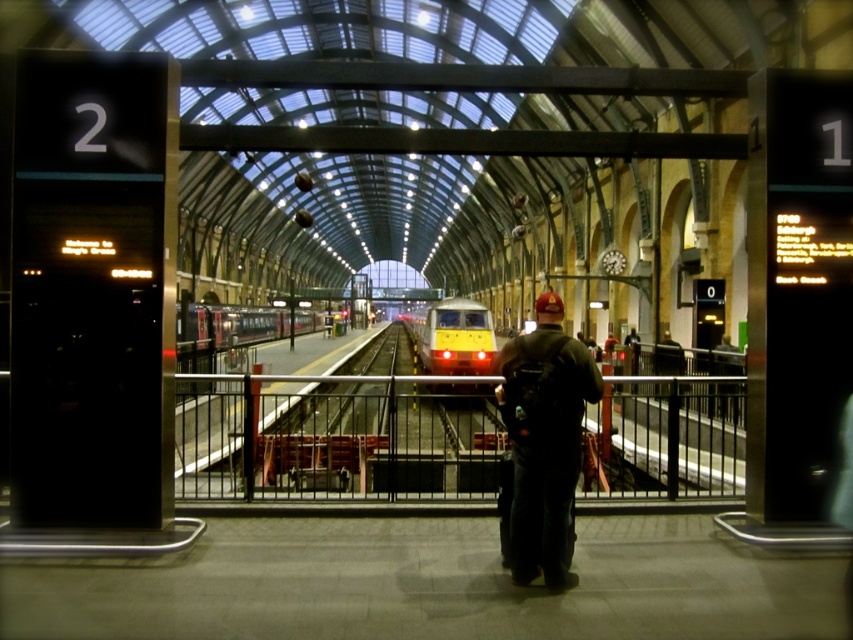
You are a passenger waiting at the train station. You see a yellow metallic train at center and a silver metallic train at center. Which train is located to the right of the other?

The yellow metallic train at center is positioned on the right side of silver metallic train at center.

You are a maintenance worker tasked with measuring the width of the metallic rail at center and the yellow metallic train at center. Which object has a greater width?

The metallic rail at center has a greater width than the yellow metallic train at center, as stated in the description.

You are a safety inspector at the train station. You notice the dark blue jeans at center and the silver metallic train at center. According to safety regulations, the minimum safe distance between a person and the train should be 20 meters. Is the current distance compliant with the safety standards?

The distance between the dark blue jeans at center and the silver metallic train at center is 22.77 meters, which exceeds the required 20 meters, so it is compliant with the safety standards.